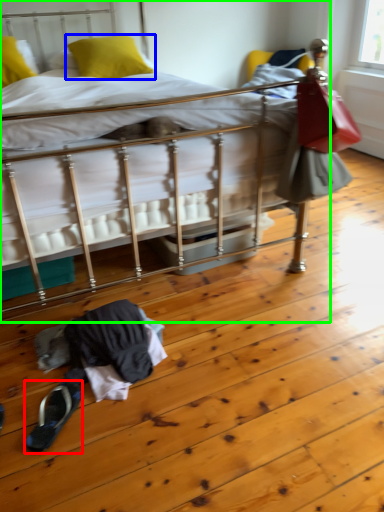
Question: Estimate the real-world distances between objects in this image. Which object is farther from footwear (highlighted by a red box), pillow (highlighted by a blue box) or bed (highlighted by a green box)?

Choices:
 (A) pillow
 (B) bed

Answer: (B)